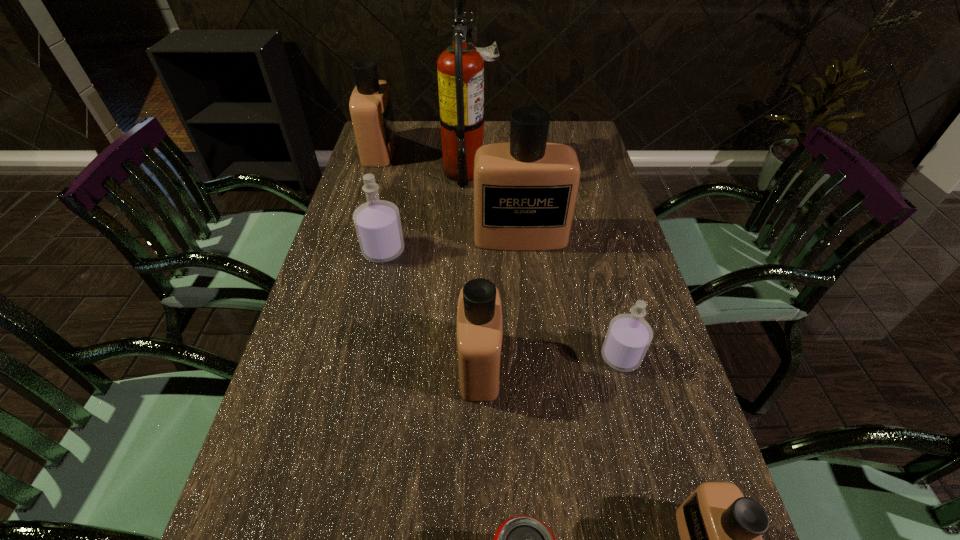
Where is `the tallest object`? The width and height of the screenshot is (960, 540). the tallest object is located at coordinates (460, 68).

Find the location of a particular element. The width and height of the screenshot is (960, 540). red fire extinguisher is located at coordinates (460, 68).

Find the location of a particular element. This screenshot has height=540, width=960. the seventh shortest object is located at coordinates (525, 190).

Find the location of `the biggest beige perfume`. the biggest beige perfume is located at coordinates (525, 190).

Locate an element on the screen. The height and width of the screenshot is (540, 960). the leftmost beige perfume is located at coordinates (370, 106).

Identify the location of the farthest perfume. This screenshot has width=960, height=540. (370, 106).

The width and height of the screenshot is (960, 540). Identify the location of the left purple perfume. (377, 222).

Find the location of a particular element. The width and height of the screenshot is (960, 540). the bigger purple perfume is located at coordinates (377, 222).

At what (x,y) coordinates should I click in order to perform the action: click on the third farthest beige perfume. Please return your answer as a coordinate pair (x, y). Looking at the image, I should click on (479, 335).

Identify the location of the nearer purple perfume. This screenshot has height=540, width=960. (628, 337).